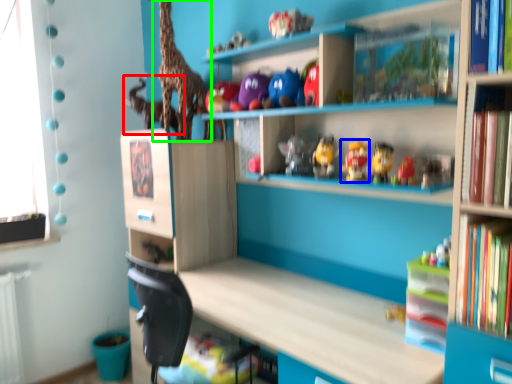
Question: Estimate the real-world distances between objects in this image. Which object is farther from animal (highlighted by a red box), toy (highlighted by a blue box) or giraffe (highlighted by a green box)?

Choices:
 (A) toy
 (B) giraffe

Answer: (A)